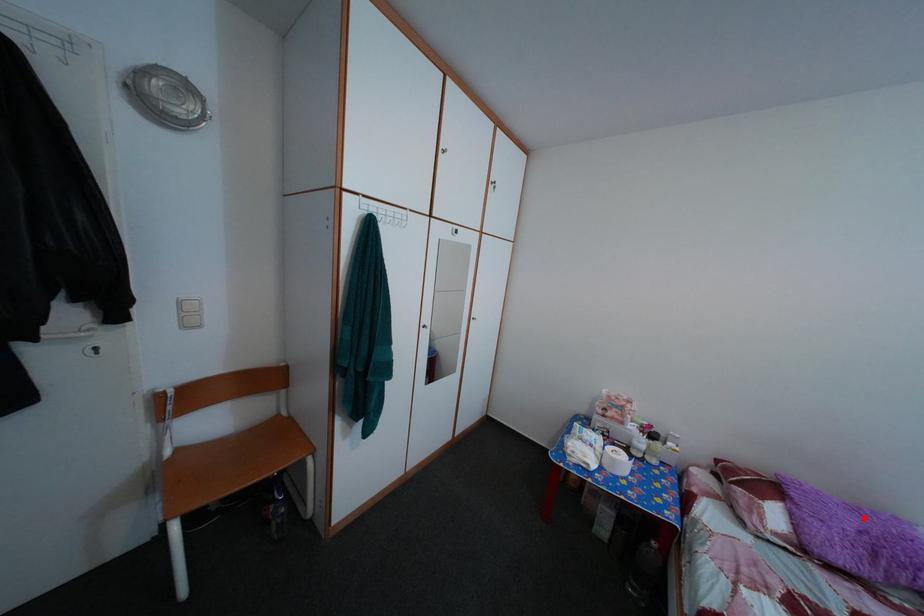
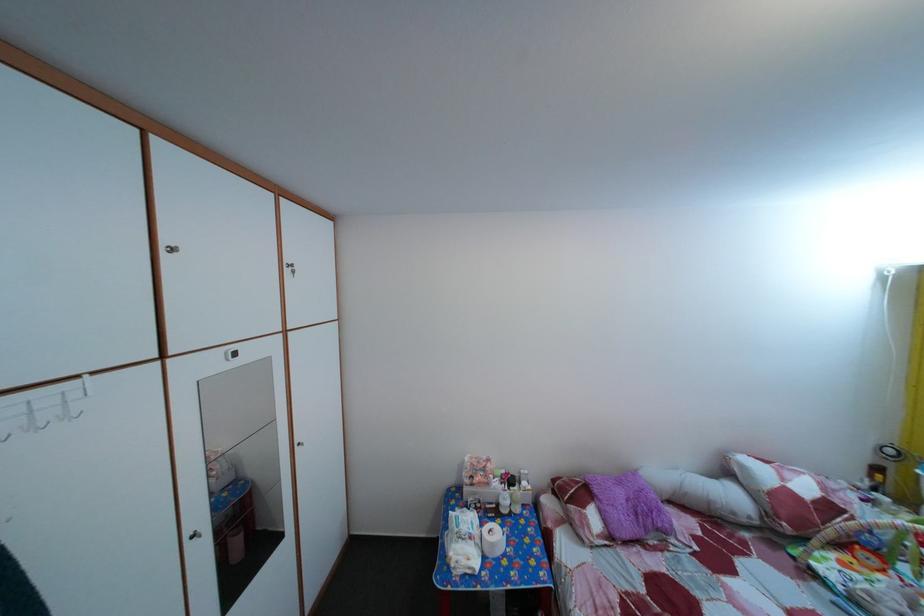
Find the pixel in the second image that matches the highlighted location in the first image.

(629, 491)